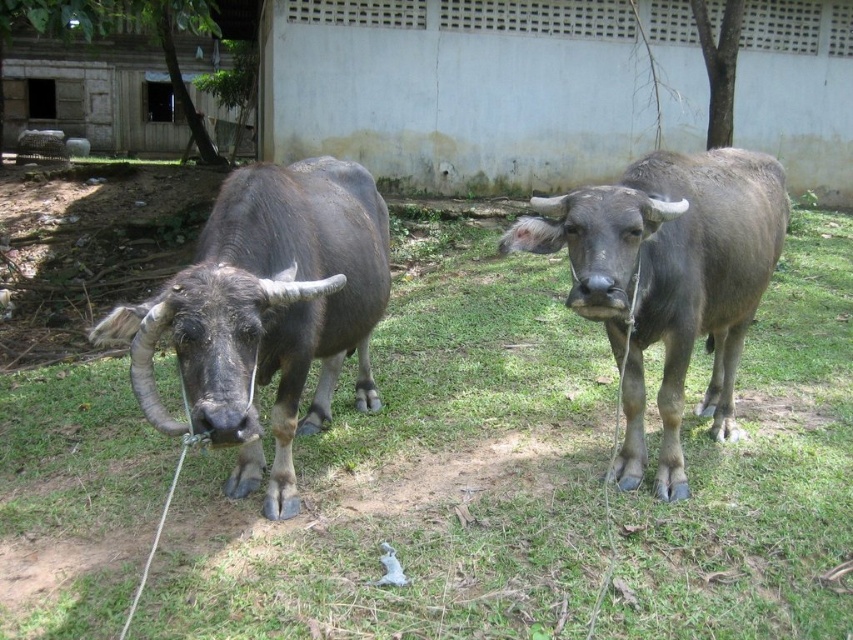
You are a farmer checking the field. You see the green grass at center and the gray matte bull at center. Which one is wider?

The green grass at center is wider than the gray matte bull at center according to the description.